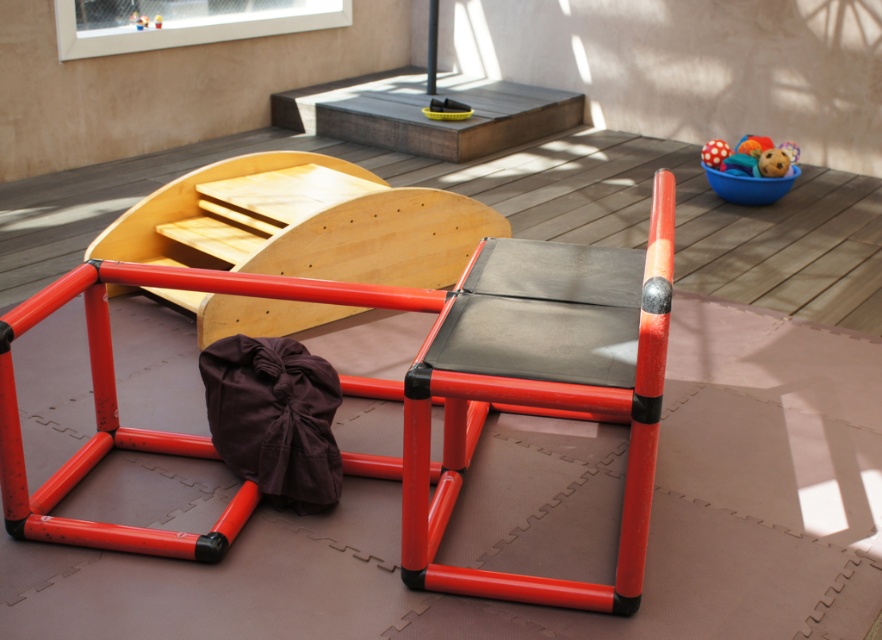
Between metallic red chair at center and rubberized plastic ball at upper right, which one has more height?

metallic red chair at center is taller.

Between point (410, 582) and point (783, 157), which one is positioned behind?

Point (783, 157)

Where is `metallic red chair at center`? metallic red chair at center is located at coordinates (543, 387).